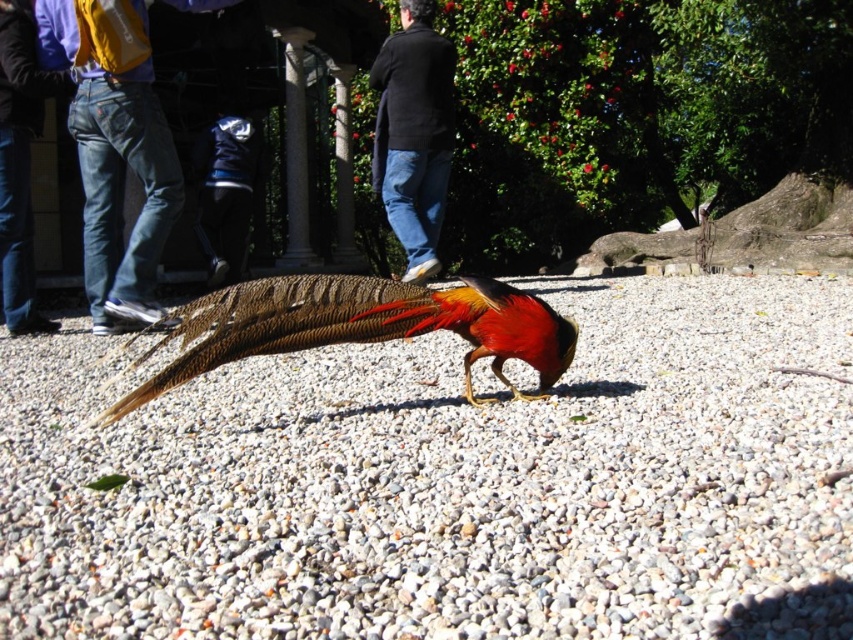
Is gray gravel at center wider than shiny golden bird at center?

Indeed, gray gravel at center has a greater width compared to shiny golden bird at center.

The width and height of the screenshot is (853, 640). In order to click on gray gravel at center in this screenshot , I will do `click(450, 483)`.

Which is in front, point (238, 406) or point (235, 328)?

Point (235, 328) is more forward.

Locate an element on the screen. This screenshot has height=640, width=853. gray gravel at center is located at coordinates (450, 483).

Is gray gravel at center positioned behind black matte sweater at center?

No, gray gravel at center is in front of black matte sweater at center.

Describe the element at coordinates (450, 483) in the screenshot. Image resolution: width=853 pixels, height=640 pixels. I see `gray gravel at center` at that location.

Locate an element on the screen. The height and width of the screenshot is (640, 853). gray gravel at center is located at coordinates (450, 483).

Who is more forward, (x=135, y=12) or (x=438, y=198)?

Point (x=135, y=12) is in front.

Can you confirm if jeans at left is wider than black matte sweater at center?

Yes, jeans at left is wider than black matte sweater at center.

Which is behind, point (148, 184) or point (434, 49)?

The point (434, 49) is behind.

Identify the location of jeans at left. (114, 152).